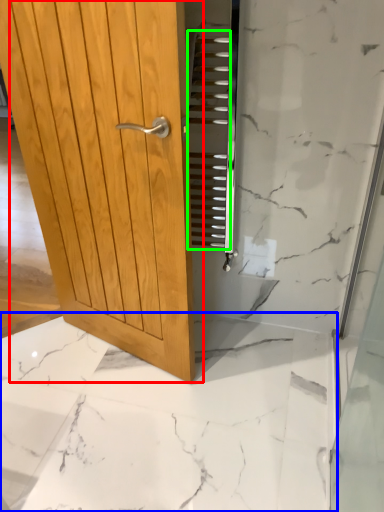
Question: Estimate the real-world distances between objects in this image. Which object is closer to door (highlighted by a red box), granite (highlighted by a blue box) or stair (highlighted by a green box)?

Choices:
 (A) granite
 (B) stair

Answer: (B)